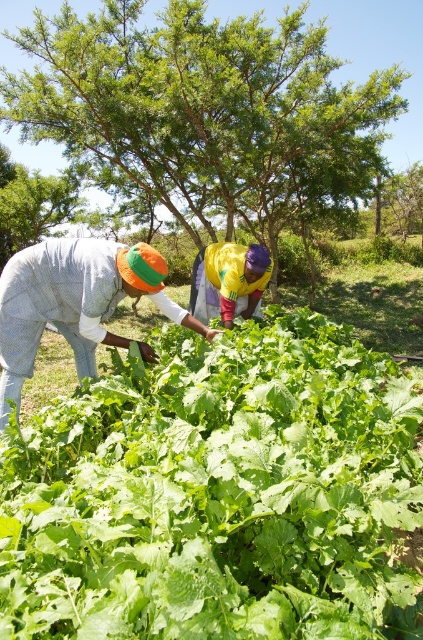
You are a farmer in the field and want to check the crops. You notice the textured cotton shirt at lower left and the yellow fabric at center. Which object is closer to the ground?

The textured cotton shirt at lower left is positioned under the yellow fabric at center, so it is closer to the ground.

You are a farmer who wants to pick the green leafy vegetable at center and the textured cotton shirt at lower left. Which one is closer to your current position?

The textured cotton shirt at lower left is closer to your current position because it is to the left of the green leafy vegetable at center.

You are standing at the origin point of the field. A green leafy vegetable at center is located at coordinates point (217, 493). If you want to walk towards the green leafy vegetable at center, which direction should you move from your current position?

The point (217, 493) is the location of the green leafy vegetable at center, so you should move towards that coordinate to reach it.